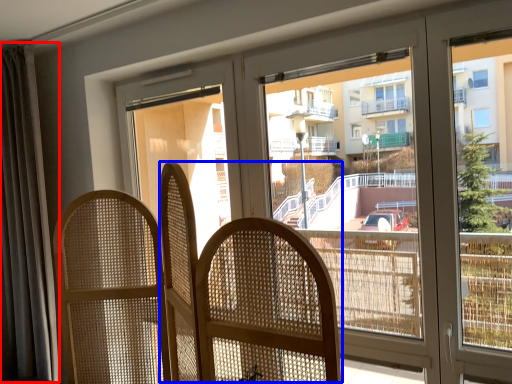
Question: Which point is closer to the camera, curtain (highlighted by a red box) or rocking chair (highlighted by a blue box)?

Choices:
 (A) curtain
 (B) rocking chair

Answer: (B)